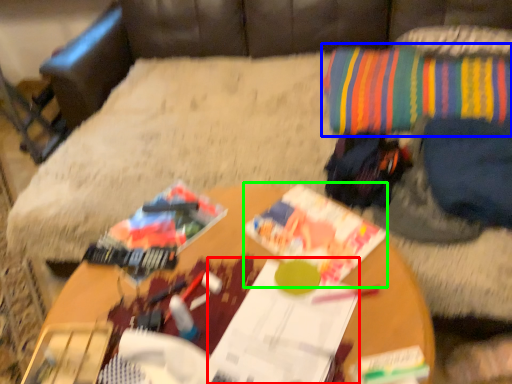
Question: Which object is the farthest from magazine (highlighted by a red box)? Choose among these: throw pillow (highlighted by a blue box) or magazine (highlighted by a green box).

Choices:
 (A) throw pillow
 (B) magazine

Answer: (A)